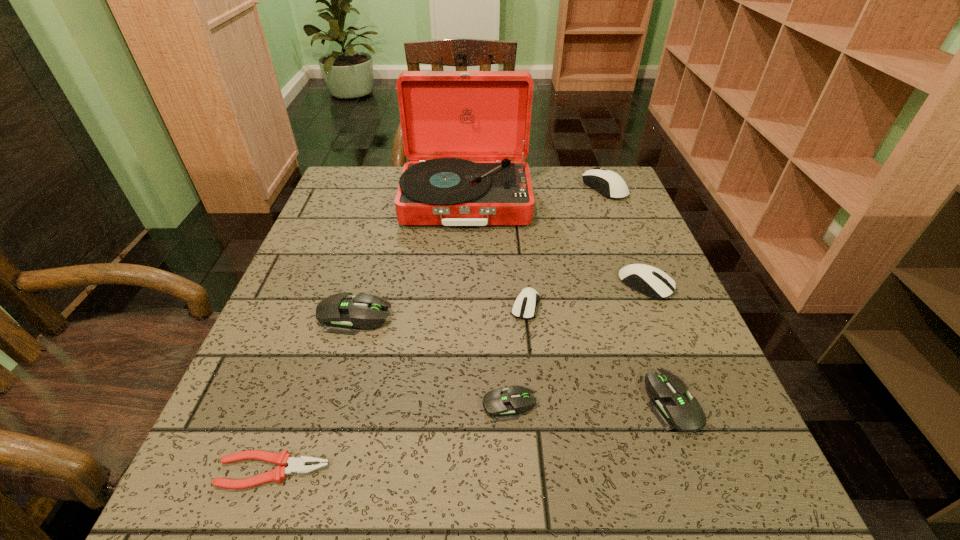
Locate an element on the screen. The image size is (960, 540). free space between the shortest computer mouse and the pliers is located at coordinates (391, 438).

You are a GUI agent. You are given a task and a screenshot of the screen. Output one action in this format:
    pyautogui.click(x=<x>, y=<y>)
    Task: Click on the free area in between the second smallest gray computer mouse and the nearest object
    The width and height of the screenshot is (960, 540).
    Given the screenshot: What is the action you would take?
    pyautogui.click(x=473, y=437)

The image size is (960, 540). I want to click on free spot between the leftmost computer mouse and the pliers, so click(314, 394).

Locate an element on the screen. blank region between the tallest object and the second smallest white mouse is located at coordinates (556, 244).

Identify the location of object identified as the fifth closest to the leftmost gray computer mouse. (675, 408).

Where is `object that is the fifth nearest to the leftmost computer mouse`? object that is the fifth nearest to the leftmost computer mouse is located at coordinates (675, 408).

Where is `computer mouse that stands as the second closest to the farthest computer mouse`? The height and width of the screenshot is (540, 960). computer mouse that stands as the second closest to the farthest computer mouse is located at coordinates (524, 307).

Select which computer mouse appears as the sixth closest to the pliers. Please provide its 2D coordinates. Your answer should be formatted as a tuple, i.e. [(x, y)], where the tuple contains the x and y coordinates of a point satisfying the conditions above.

[(597, 178)]

Where is `white mouse that is the third closest to the nearest object`? white mouse that is the third closest to the nearest object is located at coordinates [597, 178].

Select which white mouse is the closest to the farthest gray computer mouse. Please provide its 2D coordinates. Your answer should be formatted as a tuple, i.e. [(x, y)], where the tuple contains the x and y coordinates of a point satisfying the conditions above.

[(524, 307)]